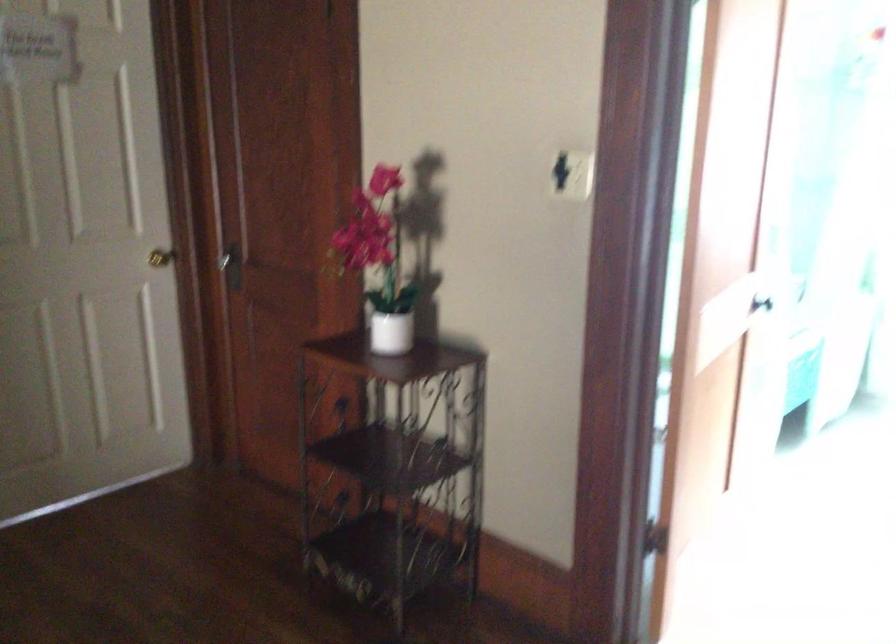
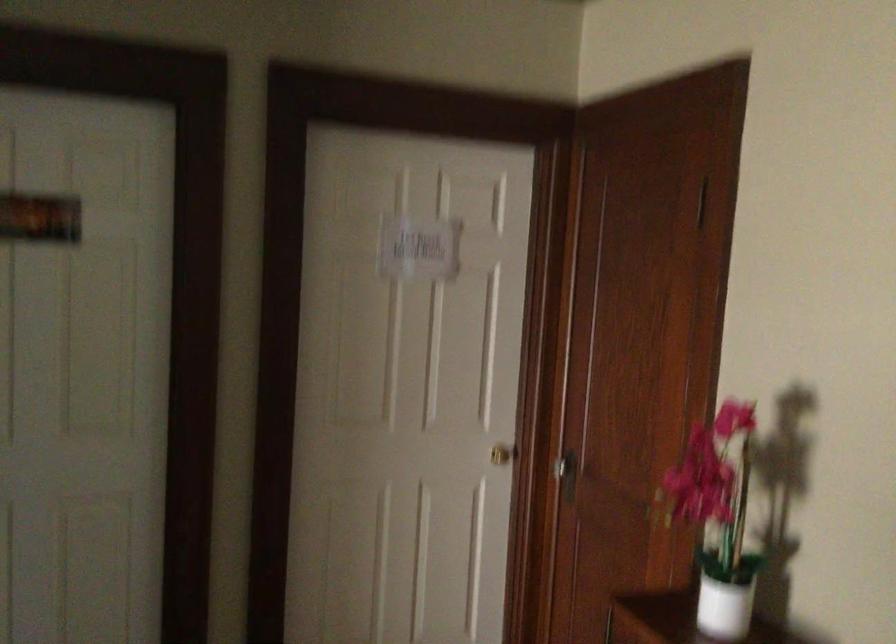
Where in the second image is the point corresponding to pixel 165 252 from the first image?

(503, 453)